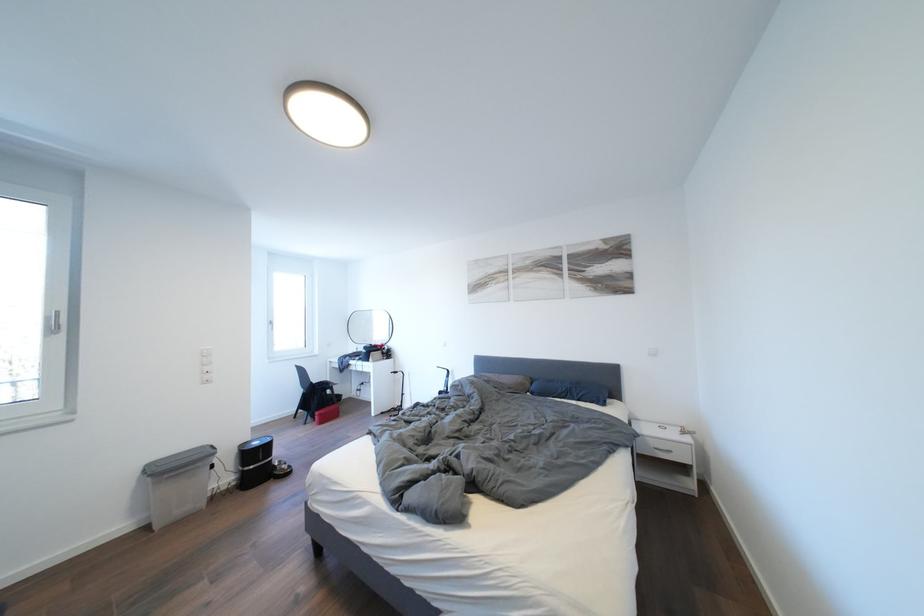
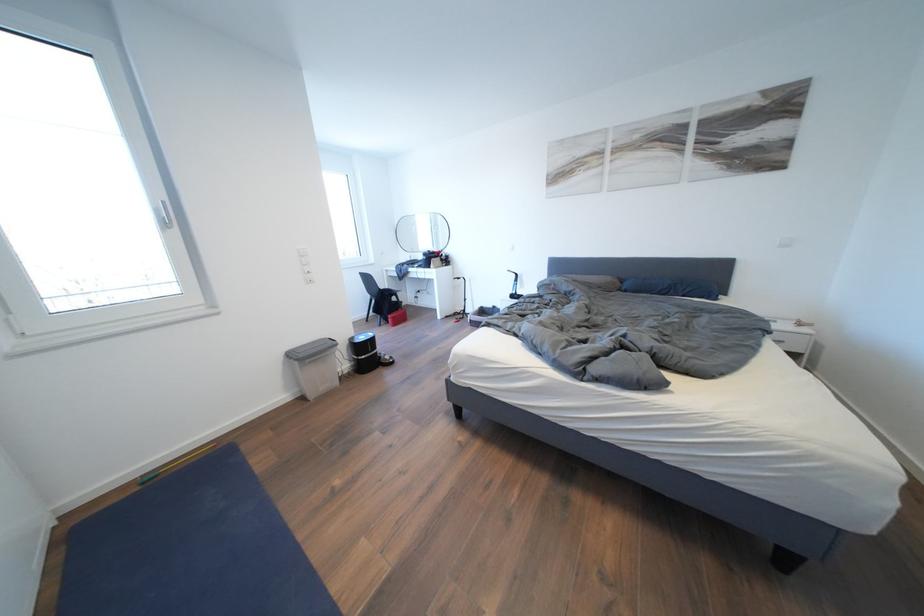
Question: The first image is from the beginning of the video and the second image is from the end. How did the camera likely rotate when shooting the video?

Choices:
 (A) Left
 (B) Right
 (C) Up
 (D) Down

Answer: (D)